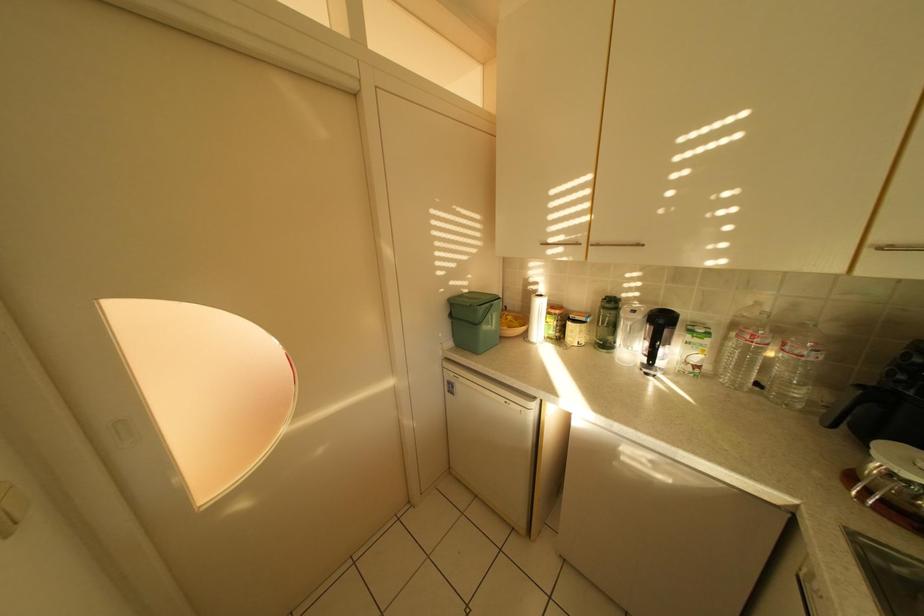
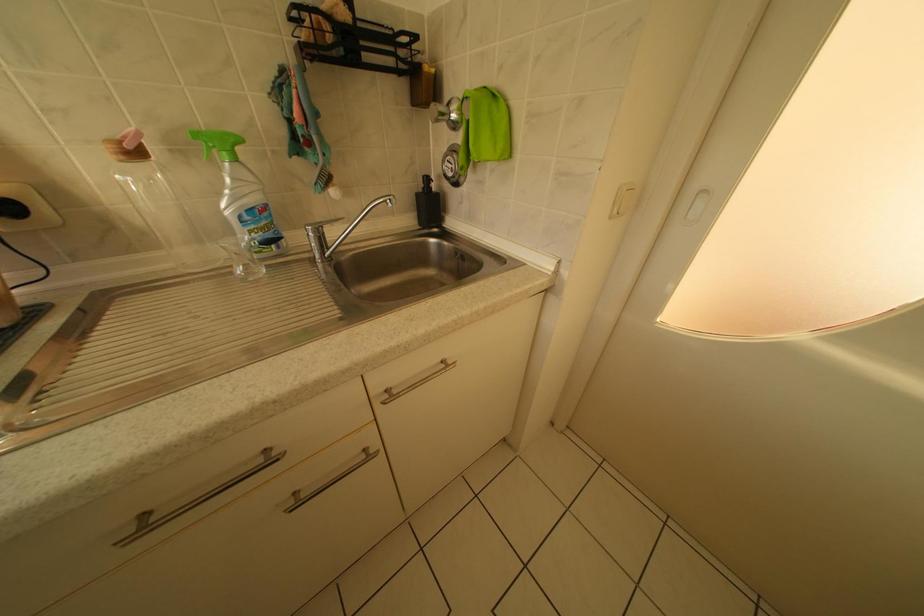
Based on the continuous images, in which direction is the camera rotating?

The camera's rotation is toward left-down.